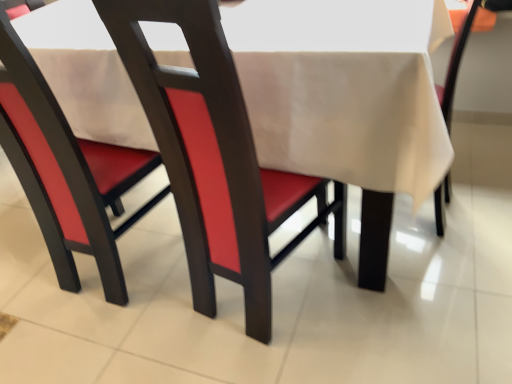
You are a GUI agent. You are given a task and a screenshot of the screen. Output one action in this format:
    pyautogui.click(x=<x>, y=<y>)
    Task: Click on the free space in front of matte wood chair at center, which is counted as the second chair, starting from the right
    The image size is (512, 384).
    Given the screenshot: What is the action you would take?
    pos(286,355)